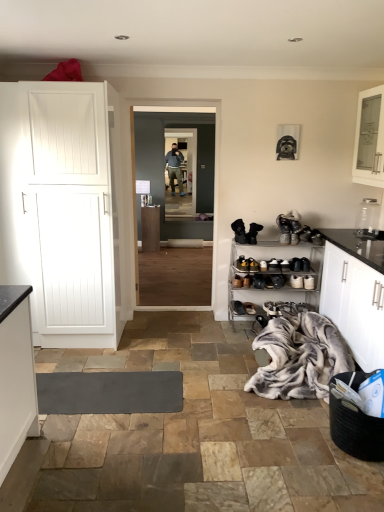
Question: Is transparent glass door at center, the 1th glass door viewed from the front, turned away from black leather shoe at lower center, the 4th footwear from the top?

Choices:
 (A) no
 (B) yes

Answer: (A)

Question: Can you confirm if transparent glass door at center, the 1th glass door viewed from the front, is taller than black leather shoe at lower center, the 4th footwear from the top?

Choices:
 (A) no
 (B) yes

Answer: (B)

Question: Considering the relative sizes of transparent glass door at center, which is the 2th glass door from back to front, and black leather shoe at lower center, placed as the 2th footwear when sorted from bottom to top, in the image provided, is transparent glass door at center, which is the 2th glass door from back to front, smaller than black leather shoe at lower center, placed as the 2th footwear when sorted from bottom to top,?

Choices:
 (A) no
 (B) yes

Answer: (A)

Question: From the image's perspective, is transparent glass door at center, which is the 2th glass door from back to front, beneath black leather shoe at lower center, the 4th footwear from the top?

Choices:
 (A) no
 (B) yes

Answer: (A)

Question: Is transparent glass door at center, the 1th glass door viewed from the front, thinner than black leather shoe at lower center, the 4th footwear from the top?

Choices:
 (A) no
 (B) yes

Answer: (B)

Question: From a real-world perspective, is brown suede shoe at lower center, the third footwear from the bottom, above or below clear glass door at center, which ranks as the 2th glass door in front-to-back order?

Choices:
 (A) above
 (B) below

Answer: (B)

Question: Is brown suede shoe at lower center, the third footwear from the bottom, inside or outside of clear glass door at center, which ranks as the 2th glass door in front-to-back order?

Choices:
 (A) outside
 (B) inside

Answer: (A)

Question: Relative to clear glass door at center, which ranks as the 2th glass door in front-to-back order, is brown suede shoe at lower center, the 3th footwear in the top-to-bottom sequence, in front or behind?

Choices:
 (A) behind
 (B) front

Answer: (B)

Question: Is brown suede shoe at lower center, the third footwear from the bottom, bigger or smaller than clear glass door at center, which ranks as the 2th glass door in front-to-back order?

Choices:
 (A) small
 (B) big

Answer: (A)

Question: Which is correct: transparent glass door at center, which is the 2th glass door from back to front, is inside black leather boots at center, the 1th footwear from the top, or outside of it?

Choices:
 (A) inside
 (B) outside

Answer: (B)

Question: From the image's perspective, is transparent glass door at center, which is the 2th glass door from back to front, above or below black leather boots at center, arranged as the fifth footwear when ordered from the bottom?

Choices:
 (A) below
 (B) above

Answer: (B)

Question: In the image, is transparent glass door at center, the 1th glass door viewed from the front, positioned in front of or behind black leather boots at center, arranged as the fifth footwear when ordered from the bottom?

Choices:
 (A) front
 (B) behind

Answer: (B)

Question: Considering the positions of transparent glass door at center, which is the 2th glass door from back to front, and black leather boots at center, arranged as the fifth footwear when ordered from the bottom, in the image, is transparent glass door at center, which is the 2th glass door from back to front, taller or shorter than black leather boots at center, arranged as the fifth footwear when ordered from the bottom,?

Choices:
 (A) tall
 (B) short

Answer: (A)

Question: Relative to clear glass door at center, which ranks as the 2th glass door in front-to-back order, is transparent glass jar at upper right in front or behind?

Choices:
 (A) front
 (B) behind

Answer: (A)

Question: Does point (370, 225) appear closer or farther from the camera than point (170, 201)?

Choices:
 (A) farther
 (B) closer

Answer: (B)